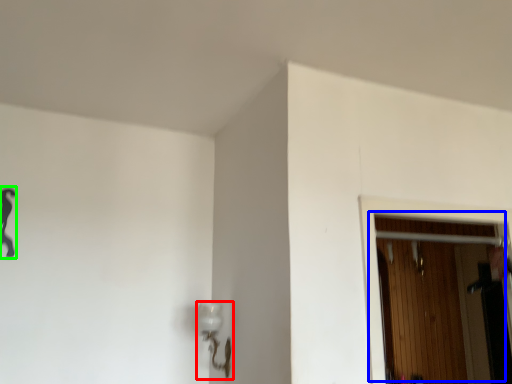
Question: Which object is the farthest from lamp (highlighted by a red box)? Choose among these: door (highlighted by a blue box) or woman (highlighted by a green box).

Choices:
 (A) door
 (B) woman

Answer: (A)